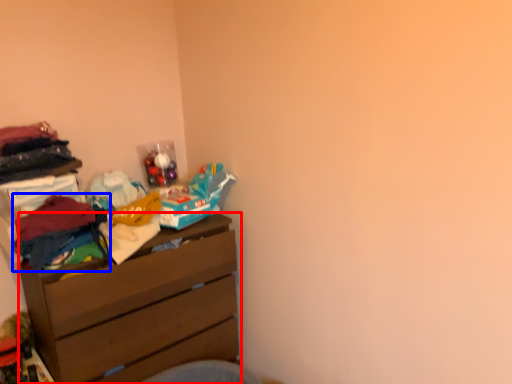
Question: Which point is closer to the camera, chest of drawers (highlighted by a red box) or clothing (highlighted by a blue box)?

Choices:
 (A) chest of drawers
 (B) clothing

Answer: (B)